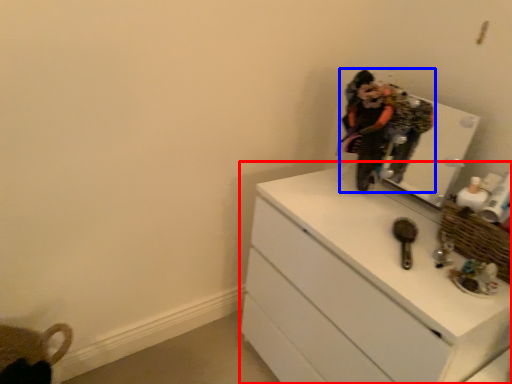
Question: Which object appears closest to the camera in this image, chest of drawers (highlighted by a red box) or person (highlighted by a blue box)?

Choices:
 (A) chest of drawers
 (B) person

Answer: (A)